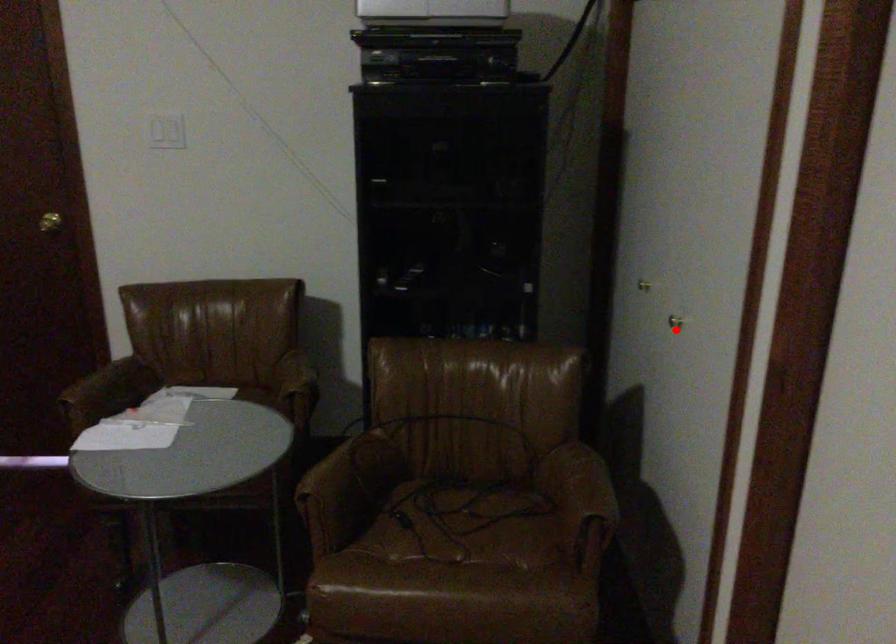
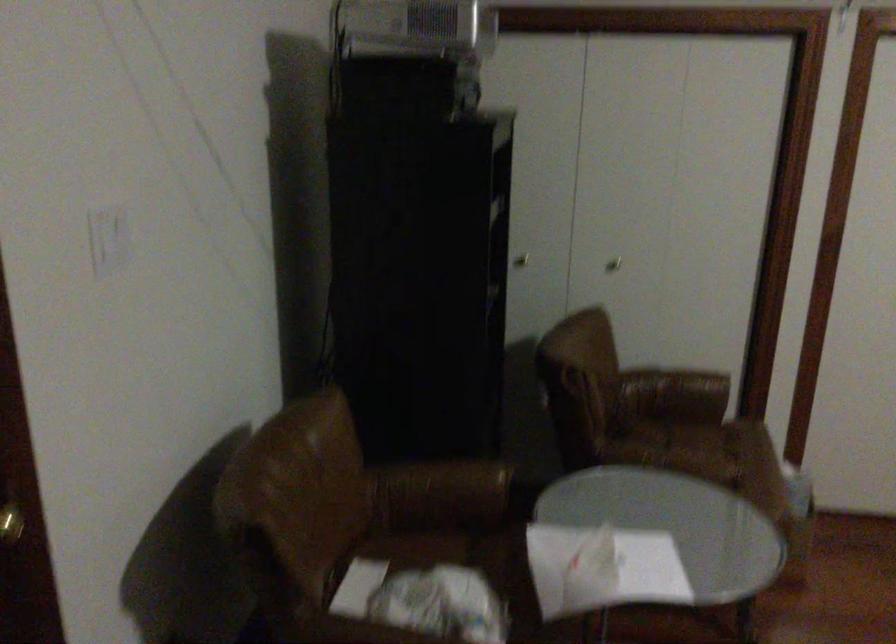
Question: A red point is marked in image1. In image2, is the corresponding 3D point closer to the camera or farther? Reply with the corresponding letter.

Choices:
 (A) The corresponding 3D point is closer.
 (B) The corresponding 3D point is farther.

Answer: (B)